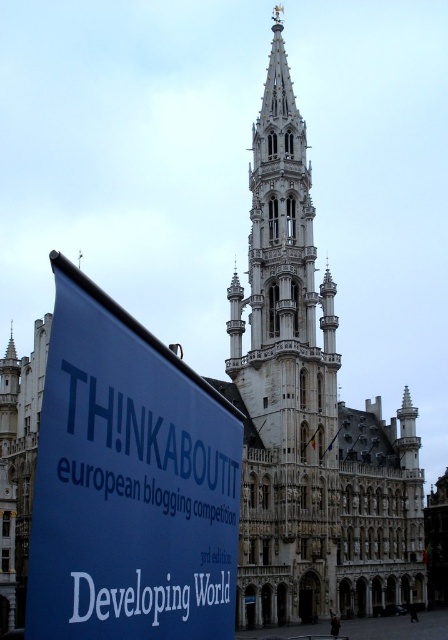
Question: Considering the relative positions of blue fabric banner at lower left and white stone tower at center in the image provided, where is blue fabric banner at lower left located with respect to white stone tower at center?

Choices:
 (A) above
 (B) below

Answer: (B)

Question: Which of the following is the closest to the observer?

Choices:
 (A) white stone tower at center
 (B) blue fabric banner at lower left

Answer: (B)

Question: Which of the following is the closest to the observer?

Choices:
 (A) white stone tower at center
 (B) blue fabric banner at lower left

Answer: (B)

Question: From the image, what is the correct spatial relationship of blue fabric banner at lower left in relation to white stone tower at center?

Choices:
 (A) above
 (B) below

Answer: (B)

Question: Does blue fabric banner at lower left have a smaller size compared to white stone tower at center?

Choices:
 (A) yes
 (B) no

Answer: (A)